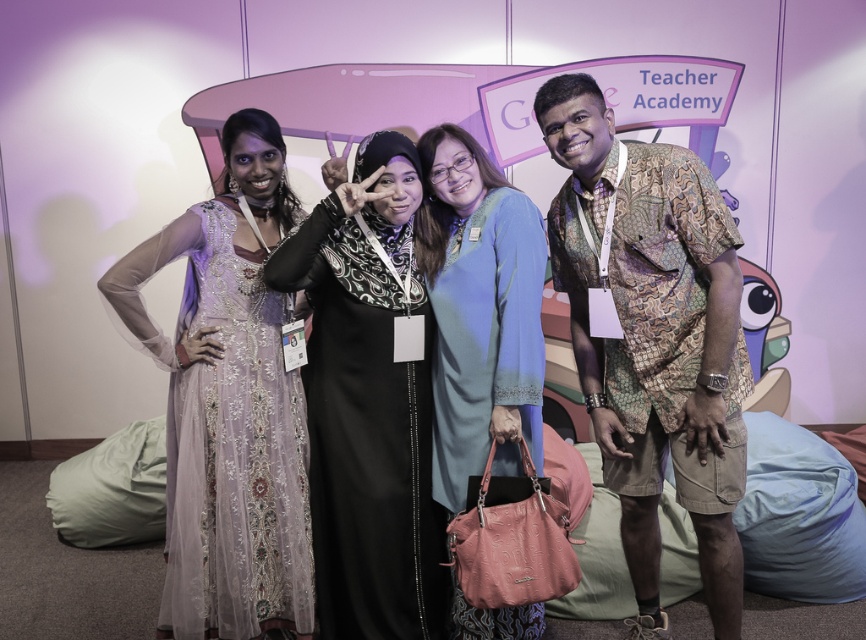
You are standing at the camera position and want to take a photo of the group. The photographer tells you that the point at coordinate point (614, 208) is 1.84 meters away from you. If you need to adjust your focus to capture this point clearly, what distance should you set your camera focus to?

You should set the camera focus to 1.84 meters because the point at coordinate point (614, 208) is 1.84 meters away from the camera.

You are attending the Google Teacher Academy event and notice two attendees wearing batik shirt at right and lavender sheer dress at left. Based on their positions, which one is standing in front of the other?

The batik shirt at right is positioned over lavender sheer dress at left, so the batik shirt at right is standing in front of the lavender sheer dress at left.

You are a photographer at the Google Teacher Academy event. You need to adjust the lighting to ensure both the batik shirt at right and the lavender sheer dress at left are visible. Considering their sizes, which one might require more focused lighting to avoid being overshadowed?

The batik shirt at right has a larger size compared to the lavender sheer dress at left, so it might require more focused lighting to ensure it stands out and isn not overshadowed by the smaller dress.